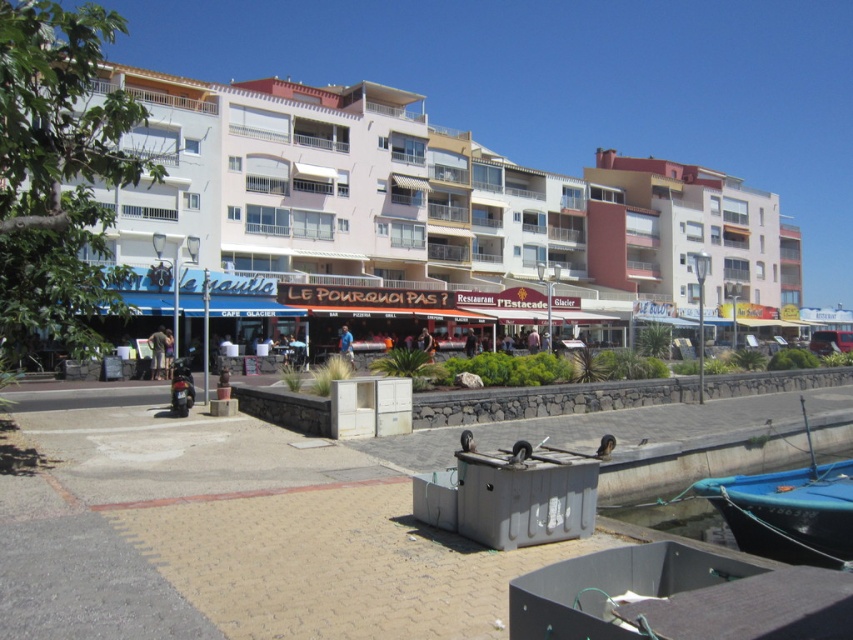
Does light brown leather jacket at center have a lesser width compared to blue fabric shirt at center?

Indeed, light brown leather jacket at center has a lesser width compared to blue fabric shirt at center.

Which is in front, point (165, 337) or point (350, 342)?

Point (165, 337) is in front.

At what (x,y) coordinates should I click in order to perform the action: click on light brown leather jacket at center. Please return your answer as a coordinate pair (x, y). This screenshot has height=640, width=853. Looking at the image, I should click on (157, 353).

Can you confirm if white matte building at center is positioned to the right of teal glossy boat at lower right?

Yes, white matte building at center is to the right of teal glossy boat at lower right.

Describe the element at coordinates (428, 202) in the screenshot. The image size is (853, 640). I see `white matte building at center` at that location.

I want to click on white matte building at center, so click(x=428, y=202).

The width and height of the screenshot is (853, 640). I want to click on white matte building at center, so click(428, 202).

Which of these two, teal glossy boat at lower right or light brown leather jacket at center, stands taller?

teal glossy boat at lower right

Is teal glossy boat at lower right shorter than light brown leather jacket at center?

Incorrect, teal glossy boat at lower right's height does not fall short of light brown leather jacket at center's.

Does point (838, 561) lie behind point (151, 346)?

That is False.

You are a GUI agent. You are given a task and a screenshot of the screen. Output one action in this format:
    pyautogui.click(x=<x>, y=<y>)
    Task: Click on the teal glossy boat at lower right
    
    Given the screenshot: What is the action you would take?
    pyautogui.click(x=788, y=509)